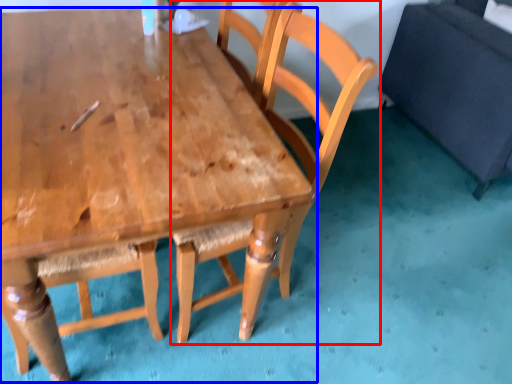
Question: Which point is closer to the camera, chair (highlighted by a red box) or table (highlighted by a blue box)?

Choices:
 (A) chair
 (B) table

Answer: (B)